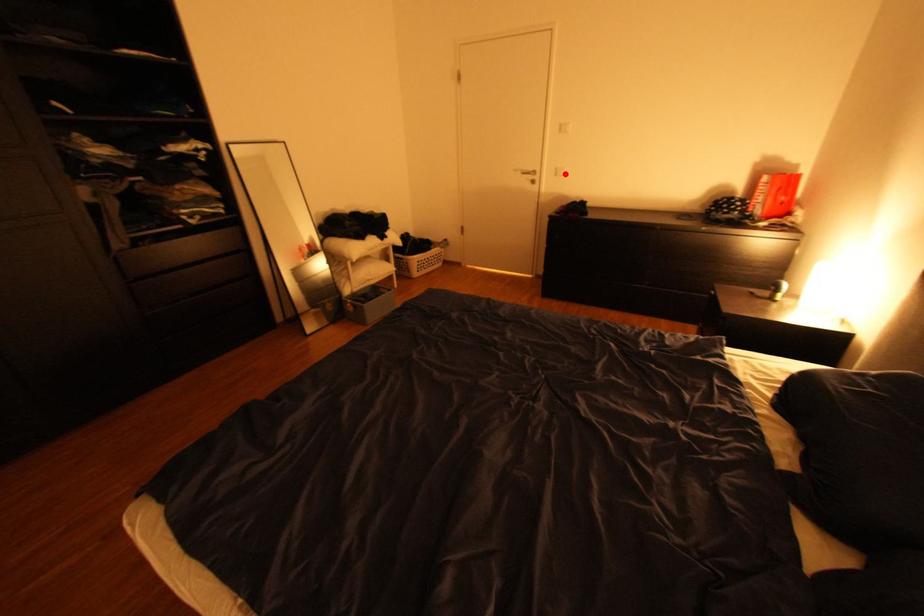
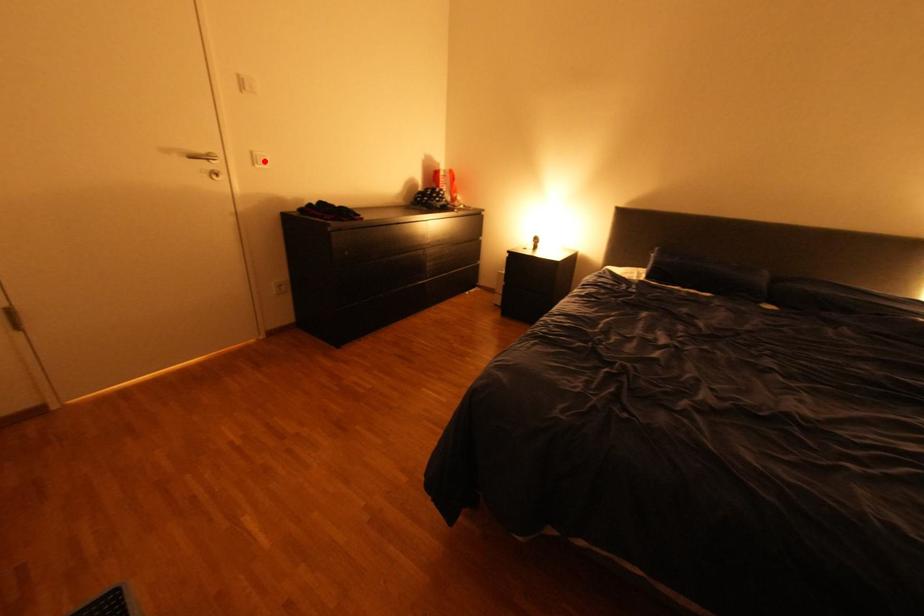
I am providing you with two images of the same scene from different viewpoints. A red point is marked on the first image and another point is marked on the second image. Does the point marked in image1 correspond to the same location as the one in image2?

Yes